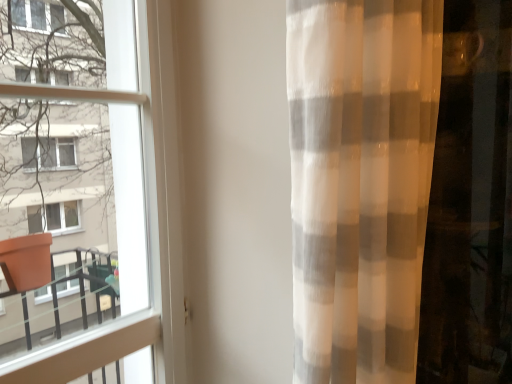
What do you see at coordinates (368, 173) in the screenshot?
I see `white sheer curtain at right` at bounding box center [368, 173].

I want to click on white sheer curtain at right, so (x=368, y=173).

What is the approximate width of white sheer curtain at right?

white sheer curtain at right is 13.46 inches wide.

Locate an element on the screen. white sheer curtain at right is located at coordinates (368, 173).